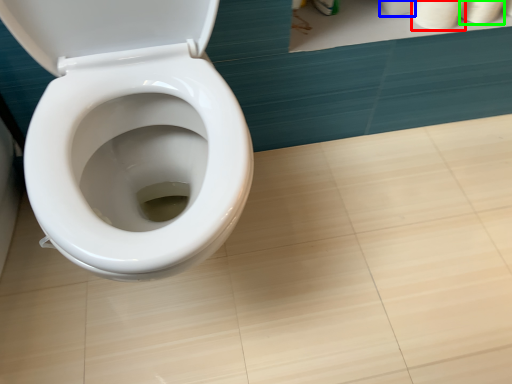
Question: Which object is the farthest from toilet paper (highlighted by a red box)? Choose among these: toilet paper (highlighted by a blue box) or toilet paper (highlighted by a green box).

Choices:
 (A) toilet paper
 (B) toilet paper

Answer: (A)